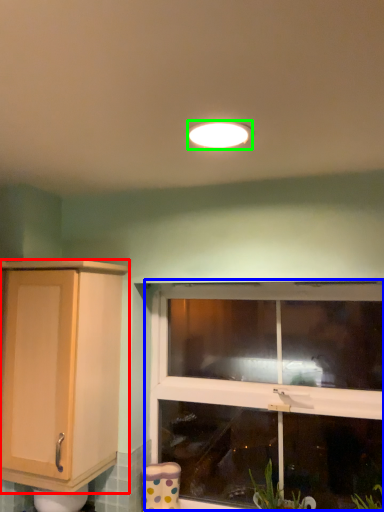
Question: Based on their relative distances, which object is farther from cabinetry (highlighted by a red box)? Choose from window (highlighted by a blue box) and light fixture (highlighted by a green box).

Choices:
 (A) window
 (B) light fixture

Answer: (B)